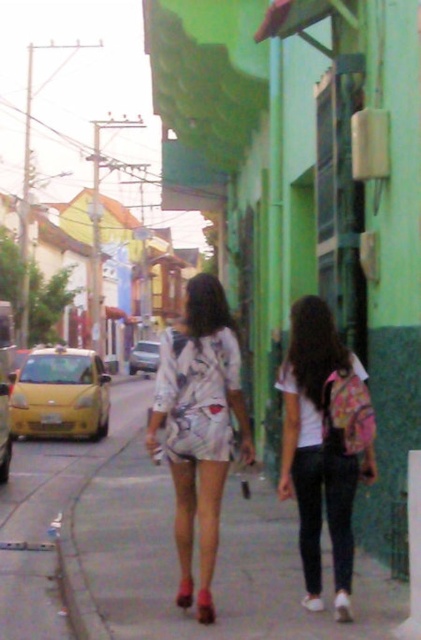
You are a photographer trying to capture the two people walking on the sidewalk. You notice the white matte shirt at center and the printed fabric dress at center. Which clothing item is positioned higher relative to the other in your camera frame?

The white matte shirt at center is above the printed fabric dress at center in the camera frame.

You are standing on the sidewalk and see the printed fabric dress at center and the smooth concrete sidewalk at center. Which object is positioned to the right of the other?

The smooth concrete sidewalk at center is to the right of the printed fabric dress at center.

You are standing at the point marked as point (215,566) in the image. Looking around, you see the smooth concrete sidewalk at center. Which direction should you walk to reach the smooth concrete sidewalk at center?

The smooth concrete sidewalk at center is located at point (215,566), so you are already standing on it.